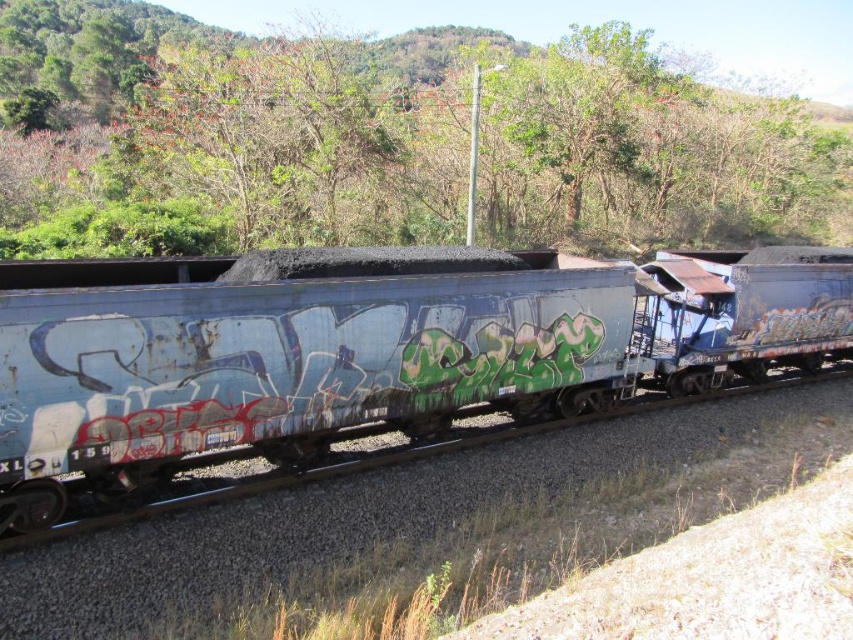
You are standing at the point marked as point (606, 67) in the image. The train is approaching you along the tracks. If you want to safely move to a spot that is 100 feet away from the camera, which direction should you go?

Since the point (606, 67) is currently 92.96 feet away from the camera, moving forward would increase your distance from the camera. To reach 100 feet, you should move forward along the direction away from the camera.

You are standing at the point where the train is located. Looking towards the direction the train is moving, which object is directly in front of you at the coordinate point (393, 138)?

The point (393, 138) indicates a green leafy tree at upper center, so the green leafy tree at upper center is directly in front of you at that coordinate.

You are standing on the train tracks and looking towards the direction the train is moving. Which direction should you turn to face the green leafy tree at upper center?

The green leafy tree at upper center is located at point coordinates of (393, 138). Since the train is moving along the tracks, turning left would orient you towards the upper center direction where the tree is located.